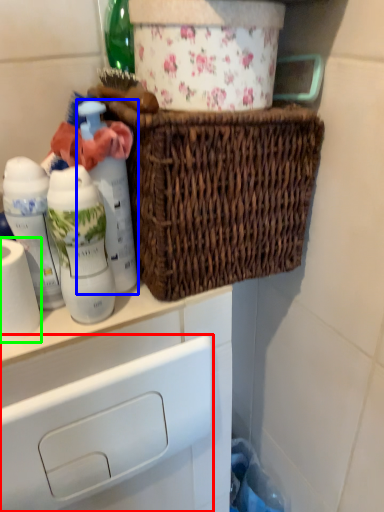
Question: Which object is positioned farthest from drawer (highlighted by a red box)? Select from bottle (highlighted by a blue box) and toilet paper (highlighted by a green box).

Choices:
 (A) bottle
 (B) toilet paper

Answer: (A)